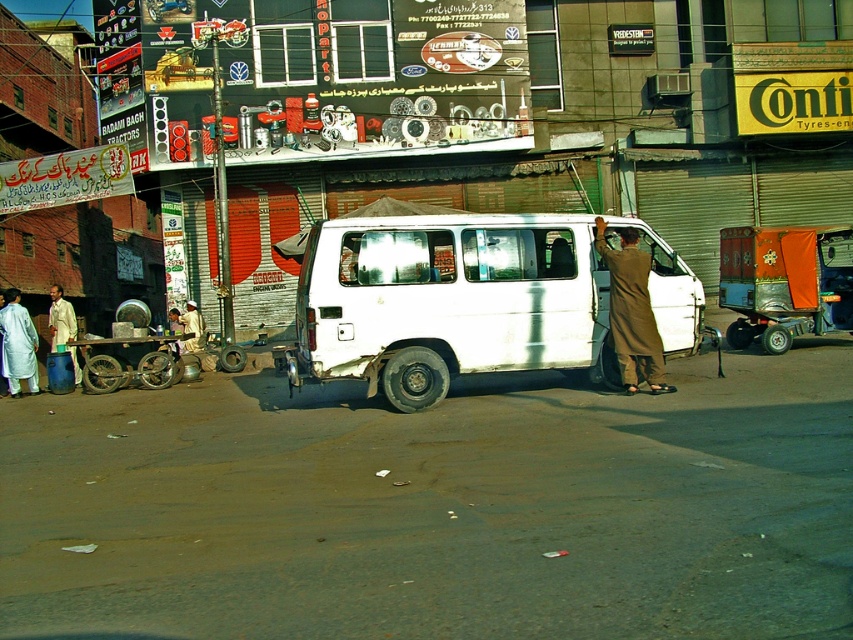
You are a delivery person who needs to pick up a package from the metallic silver cart at lower left. The delivery truck is parked 60 feet away from the cart. Can you walk from the delivery truck to the cart without needing to move any other objects?

The metallic silver cart at lower left is 57.50 feet from the camera. Since the delivery truck is parked 60 feet away from the cart, you can walk from the delivery truck to the cart without needing to move any other objects as the distance between them allows for unobstructed movement.

You are a delivery person trying to navigate through the scene. There is an orange fabric cart at right and a white cotton robe at left. Which object is blocking your path if you are approaching from the front of the scene?

The orange fabric cart at right is positioned over white cotton robe at left, so the orange fabric cart at right is blocking the path.

You are a delivery person who needs to place a package on the brown fabric at right and the metallic silver cart at lower left. Since you can only carry one item at a time, which object should you approach first if you want to minimize the distance walked?

You should approach the metallic silver cart at lower left first because it is closer to the delivery person than the brown fabric at right, which is further away to the right side.